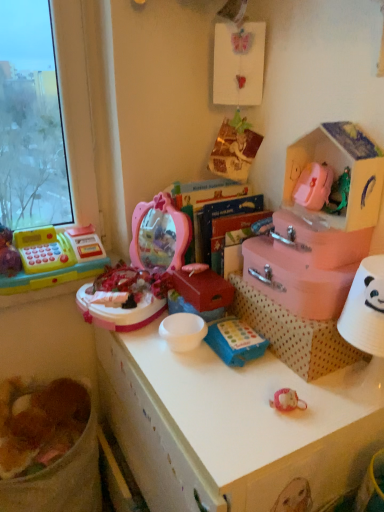
Identify the location of free space above pink plastic toy at center-right, positioned as the 1th box in right-to-left order (from a real-world perspective). The width and height of the screenshot is (384, 512). (316, 217).